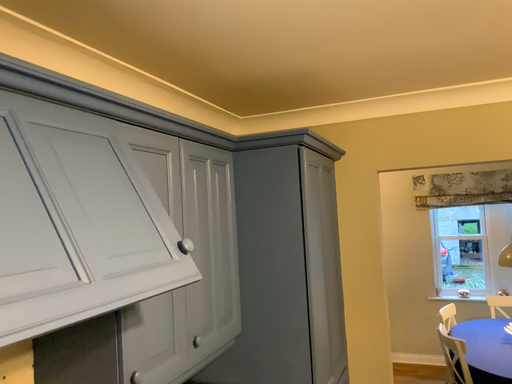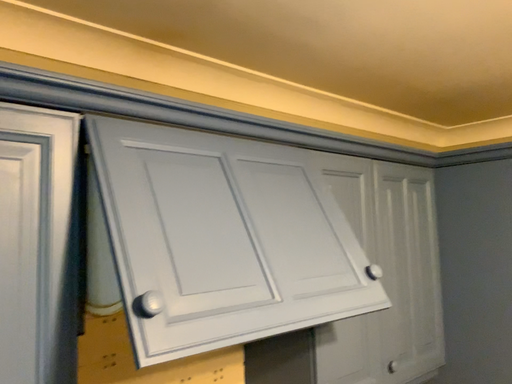
Question: Which way did the camera rotate in the video?

Choices:
 (A) rotated right
 (B) rotated left

Answer: (B)